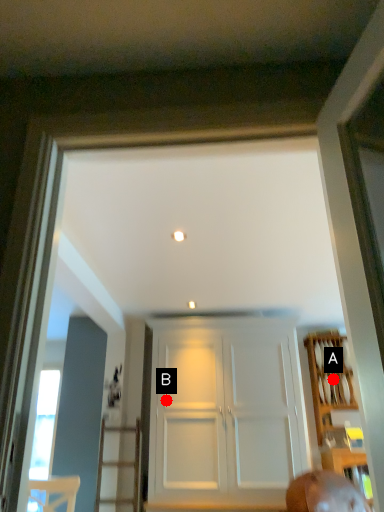
Question: Two points are circled on the image, labeled by A and B beside each circle. Which point is closer to the camera taking this photo?

Choices:
 (A) A is closer
 (B) B is closer

Answer: (B)